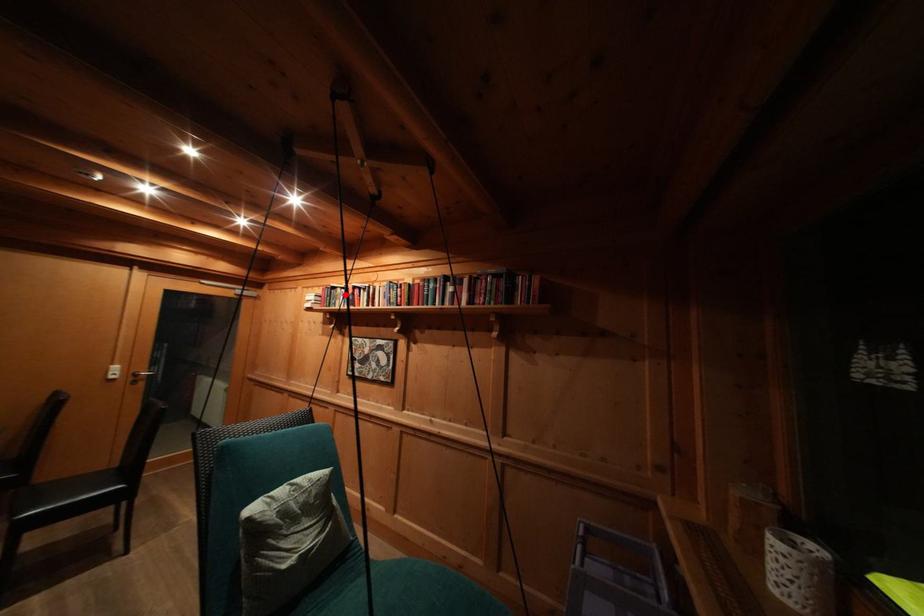
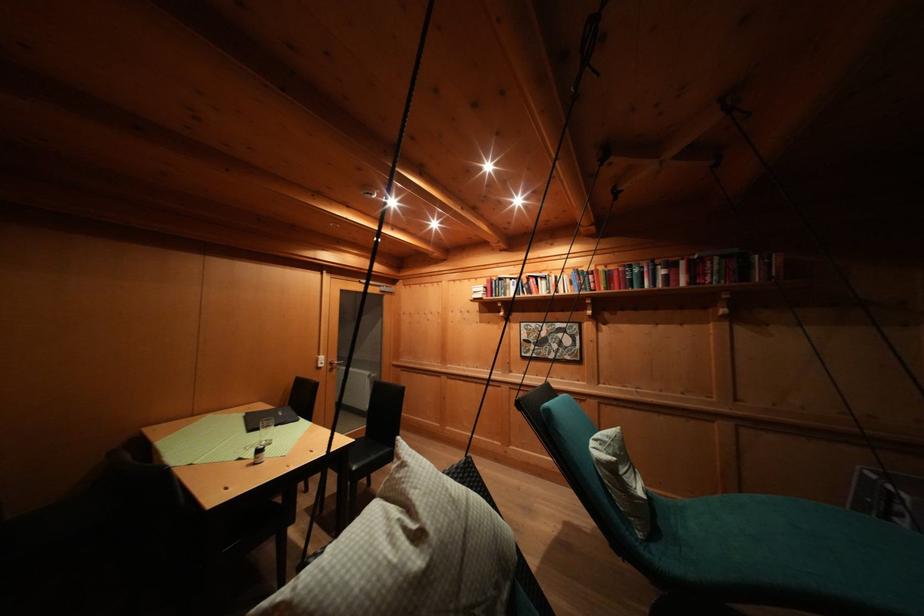
In the second image, find the point that corresponds to the highlighted location in the first image.

(514, 285)